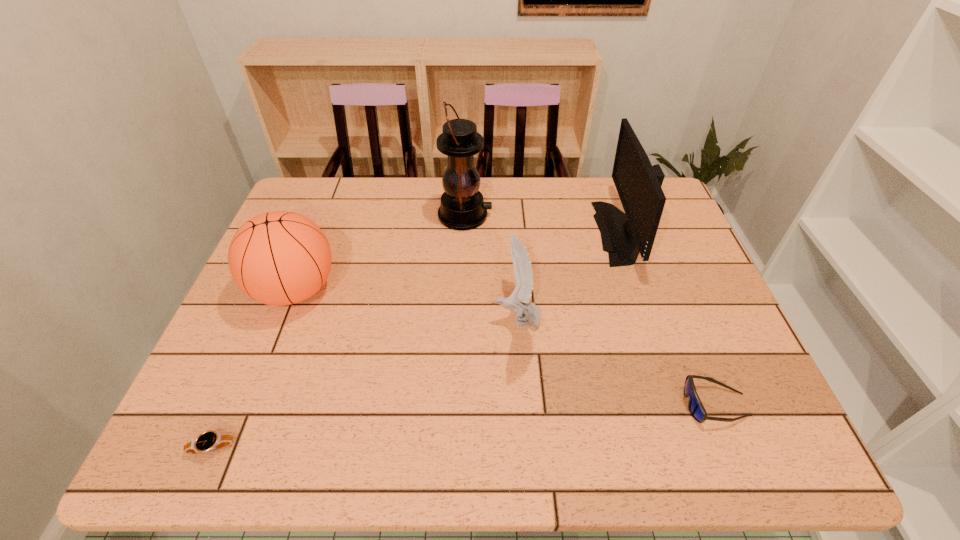
You are a GUI agent. You are given a task and a screenshot of the screen. Output one action in this format:
    pyautogui.click(x=<x>, y=<y>)
    Task: Click on the lantern that is at the far edge
    
    Given the screenshot: What is the action you would take?
    pyautogui.click(x=462, y=207)

This screenshot has height=540, width=960. I want to click on monitor located in the far edge section of the desktop, so click(x=638, y=183).

The image size is (960, 540). What are the coordinates of `sunglasses that is at the near edge` in the screenshot? It's located at (695, 406).

Identify the location of watch present at the near edge. The height and width of the screenshot is (540, 960). [210, 440].

You are a GUI agent. You are given a task and a screenshot of the screen. Output one action in this format:
    pyautogui.click(x=<x>, y=<y>)
    Task: Click on the basketball at the left edge
    The image size is (960, 540).
    Given the screenshot: What is the action you would take?
    pyautogui.click(x=278, y=258)

Locate an element on the screen. watch located in the left edge section of the desktop is located at coordinates (210, 440).

You are a GUI agent. You are given a task and a screenshot of the screen. Output one action in this format:
    pyautogui.click(x=<x>, y=<y>)
    Task: Click on the monitor that is at the right edge
    This screenshot has width=960, height=540.
    Given the screenshot: What is the action you would take?
    pyautogui.click(x=638, y=183)

Image resolution: width=960 pixels, height=540 pixels. Find the location of `sunglasses at the right edge`. sunglasses at the right edge is located at coordinates (695, 406).

Image resolution: width=960 pixels, height=540 pixels. Find the location of `object situated at the near left corner`. object situated at the near left corner is located at coordinates [x=210, y=440].

Image resolution: width=960 pixels, height=540 pixels. Find the location of `object located in the far right corner section of the desktop`. object located in the far right corner section of the desktop is located at coordinates (638, 183).